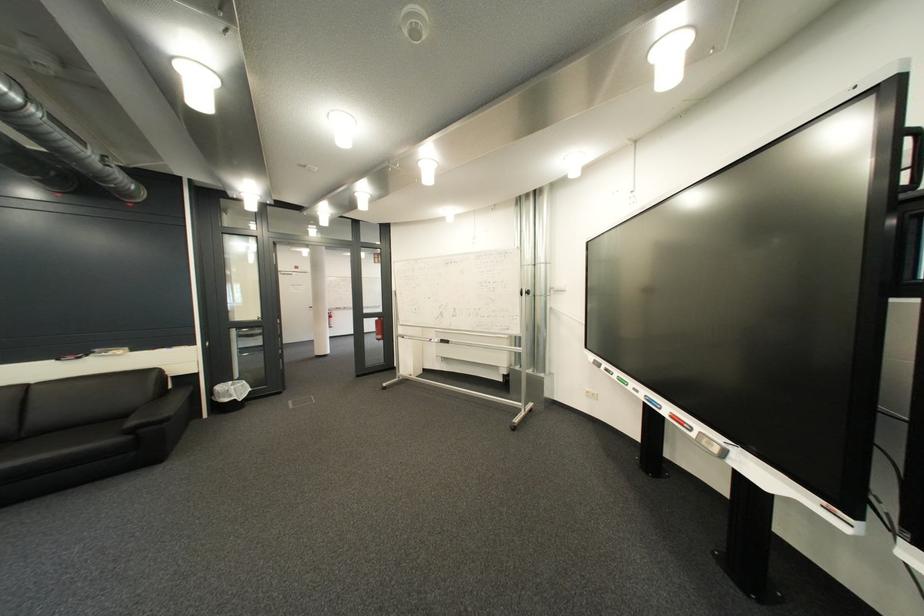
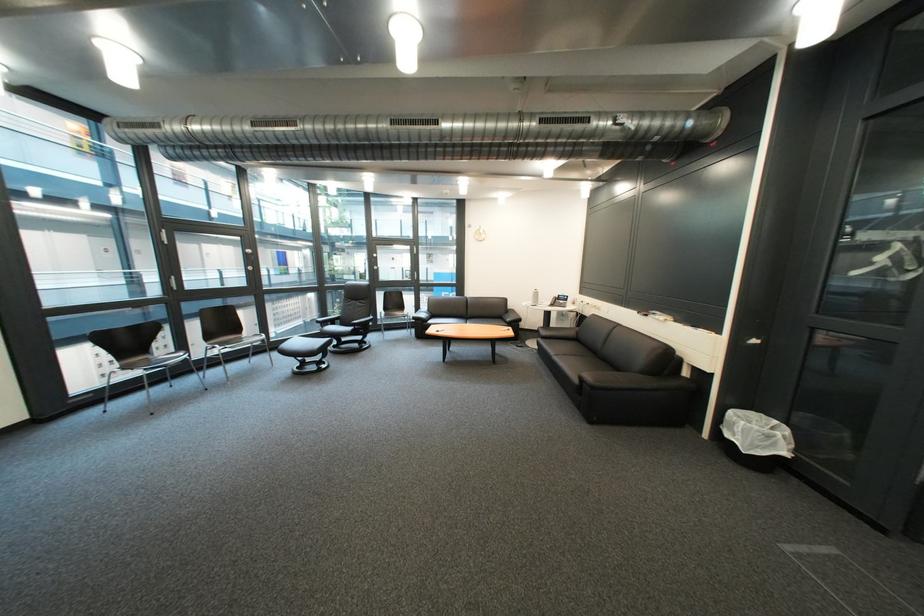
Locate, in the second image, the point that corresponds to pixel 185 387 in the first image.

(699, 375)